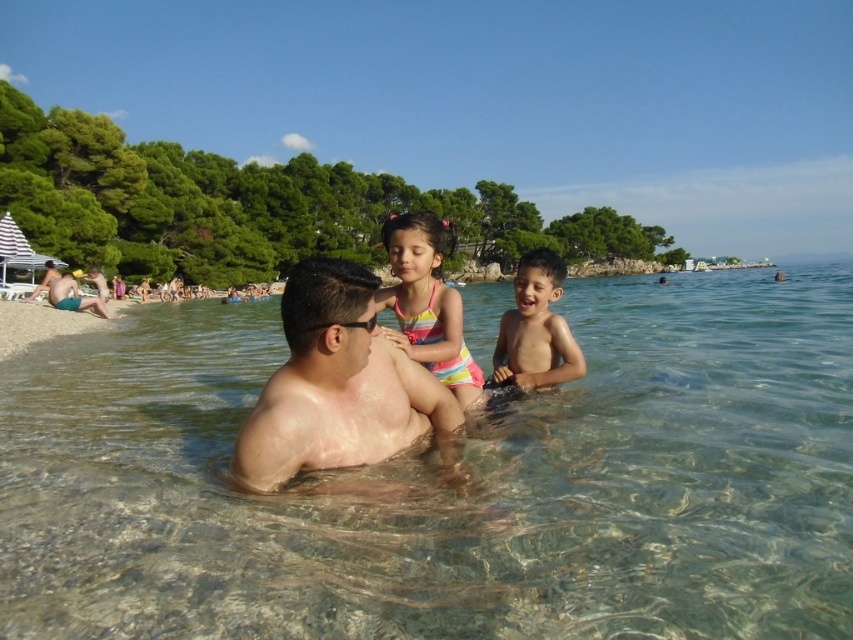
Is point (393, 444) behind point (82, 321)?

No, it is not.

Is point (370, 304) positioned after point (3, 308)?

No.

You are a GUI agent. You are given a task and a screenshot of the screen. Output one action in this format:
    pyautogui.click(x=<x>, y=<y>)
    Task: Click on the smooth skin man at center
    This screenshot has height=640, width=853.
    Given the screenshot: What is the action you would take?
    pyautogui.click(x=335, y=385)

How distant is smooth skin boy at center from matte blue shorts at left?

They are 93.24 feet apart.

Which of these two, smooth skin boy at center or matte blue shorts at left, stands taller?

matte blue shorts at left

Is point (502, 340) in front of point (74, 294)?

Yes, point (502, 340) is closer to viewer.

What are the coordinates of `smooth skin boy at center` in the screenshot? It's located at (537, 328).

Between point (402, 488) and point (56, 284), which one is positioned in front?

Positioned in front is point (402, 488).

This screenshot has width=853, height=640. What are the coordinates of `clear water at center` in the screenshot? It's located at (451, 483).

The image size is (853, 640). I want to click on clear water at center, so click(x=451, y=483).